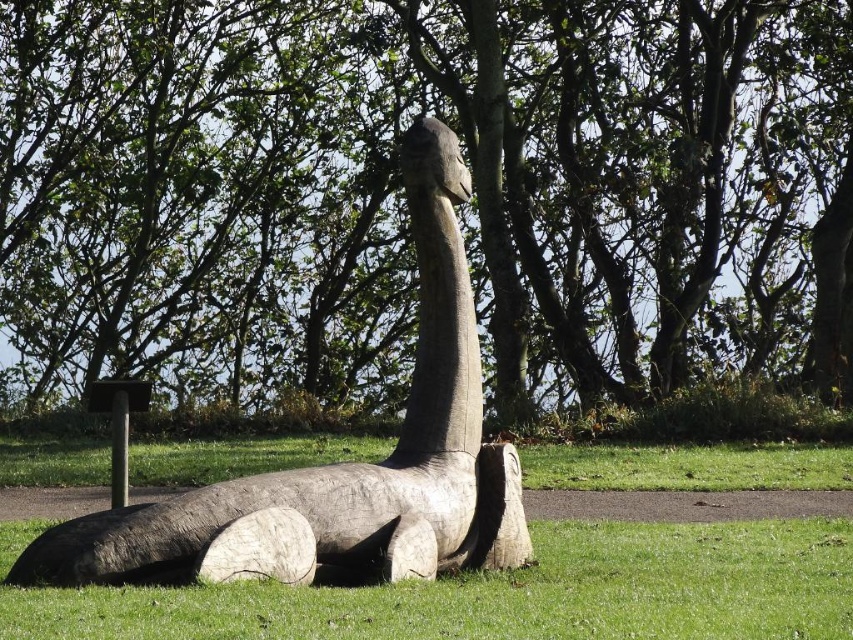
You are an artist planning to paint the green matte wood at center and the wooden statue at center. If you have a limited amount of paint, which object requires more paint due to its larger surface area?

The green matte wood at center requires more paint because its width is greater than the wooden statue at center, leading to a larger surface area.

You are a landscape architect designing a garden and want to place a new bench between the green wood tree at center and the wooden statue at center. Based on their positions, which object should the bench be closer to?

The bench should be placed closer to the wooden statue at center because the green wood tree at center is positioned over the wooden statue at center, meaning the statue is beneath the tree. Therefore, the bench should be closer to the statue to avoid being under the tree.

You are an artist planning to paint the sculpture. You have two green paints, one for the green wood tree at center and another for the green matte wood at center. According to their positions, which paint should you use first to maintain a natural gradient from left to right?

The green wood tree at center is on the left side of the green matte wood at center, so you should start painting with the green wood tree at center first to create a natural left to right gradient.